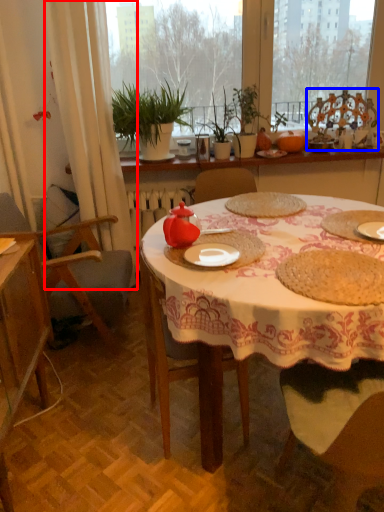
Question: Which object appears closest to the camera in this image, curtain (highlighted by a red box) or chair (highlighted by a blue box)?

Choices:
 (A) curtain
 (B) chair

Answer: (A)